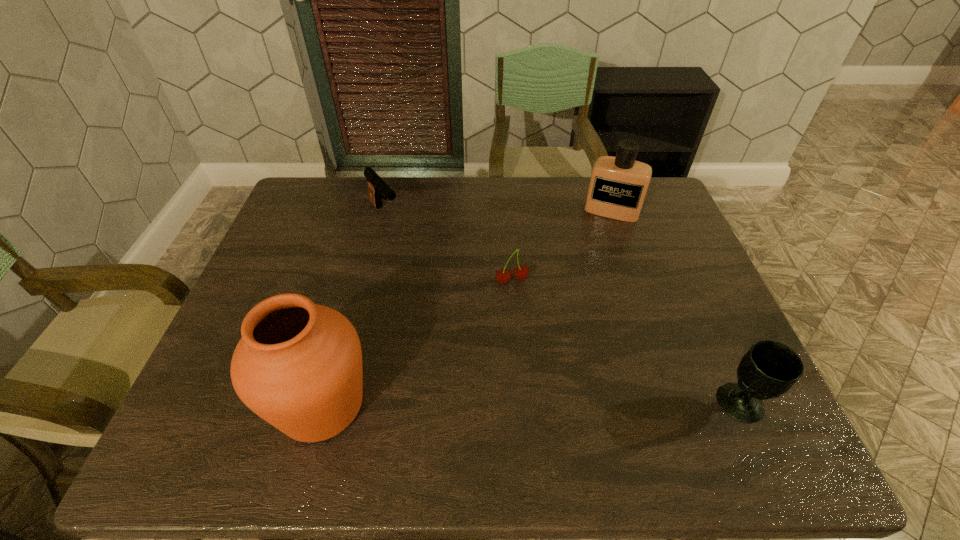
Identify the location of vacant space on the desktop that is between the urn and the chalice and is positioned on the surface of the cherry. This screenshot has height=540, width=960. (557, 404).

Find the location of `vacant space on the desktop that is between the tallest object and the chalice and is positioned on the front label of the second tallest object`. vacant space on the desktop that is between the tallest object and the chalice and is positioned on the front label of the second tallest object is located at coordinates (556, 404).

Where is `vacant spot on the desktop that is between the tallest object and the chalice and is positioned at the barrel of the pistol`? Image resolution: width=960 pixels, height=540 pixels. vacant spot on the desktop that is between the tallest object and the chalice and is positioned at the barrel of the pistol is located at coordinates (560, 404).